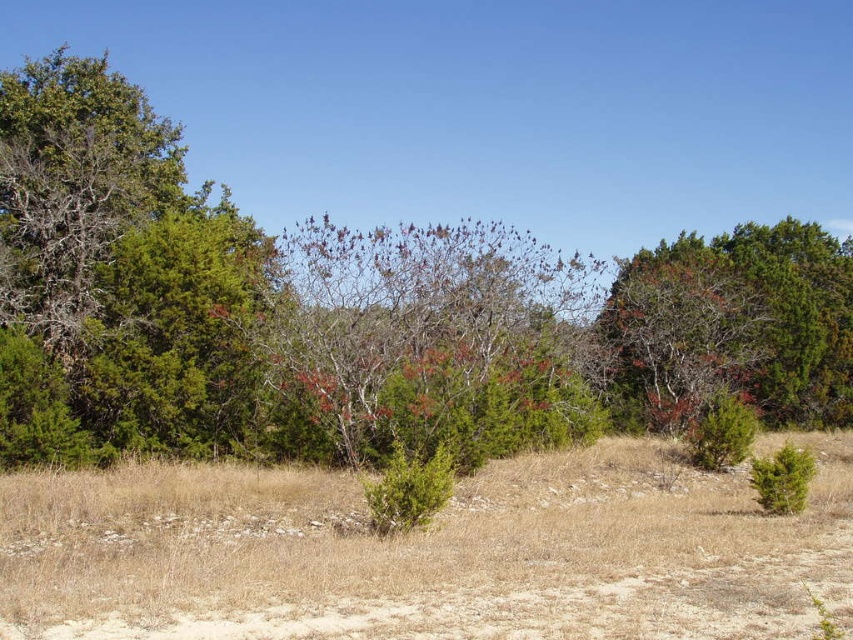
Question: Which point is farther from the camera taking this photo?

Choices:
 (A) (505, 595)
 (B) (401, 474)
 (C) (415, 243)

Answer: (C)

Question: Among these objects, which one is nearest to the camera?

Choices:
 (A) bare branches at center
 (B) green matte tree at center
 (C) brown dry grass at center
 (D) bare branches at upper right

Answer: (C)

Question: Can you confirm if brown dry grass at center is bigger than green textured bush at lower right?

Choices:
 (A) yes
 (B) no

Answer: (A)

Question: Is bare branches at upper right above green textured bush at lower right?

Choices:
 (A) yes
 (B) no

Answer: (A)

Question: Which point is farther from the camera taking this photo?

Choices:
 (A) (373, 506)
 (B) (732, 448)
 (C) (776, 483)
 (D) (753, 390)

Answer: (D)

Question: Can you confirm if green matte tree at center is bigger than bare branches at center?

Choices:
 (A) yes
 (B) no

Answer: (A)